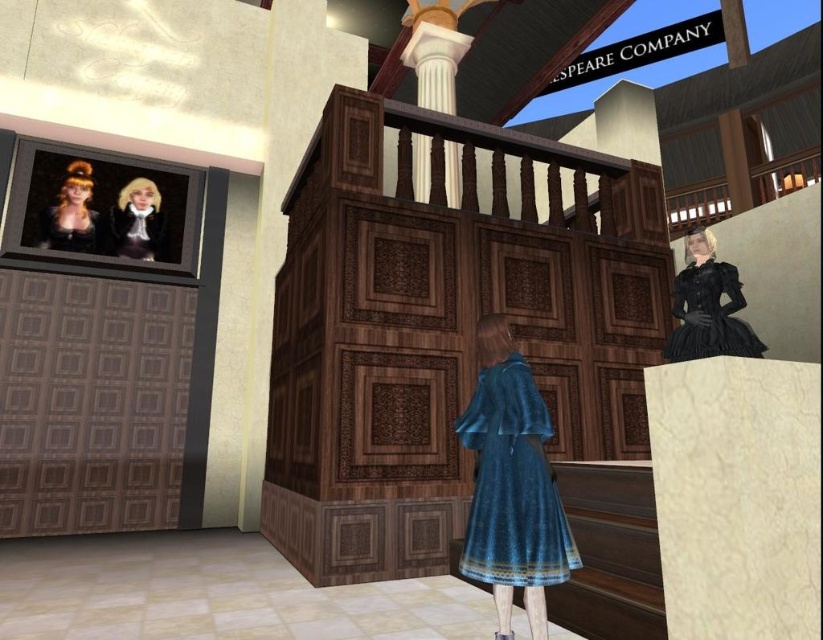
Does smooth black dress at upper left have a greater width compared to matte black dress at upper left?

Yes, smooth black dress at upper left is wider than matte black dress at upper left.

What do you see at coordinates (138, 221) in the screenshot? I see `smooth black dress at upper left` at bounding box center [138, 221].

Image resolution: width=823 pixels, height=640 pixels. What do you see at coordinates (138, 221) in the screenshot?
I see `smooth black dress at upper left` at bounding box center [138, 221].

Where is `smooth black dress at upper left`? This screenshot has width=823, height=640. smooth black dress at upper left is located at coordinates (138, 221).

Can you confirm if velvet blue dress at center is smaller than smooth black dress at upper left?

Incorrect, velvet blue dress at center is not smaller in size than smooth black dress at upper left.

Is velvet blue dress at center below smooth black dress at upper left?

Yes, velvet blue dress at center is below smooth black dress at upper left.

Which is behind, point (510, 477) or point (142, 241)?

The point (142, 241) is more distant.

Locate an element on the screen. The width and height of the screenshot is (823, 640). velvet blue dress at center is located at coordinates (512, 484).

Does black satin dress at upper right have a larger size compared to matte black hair at upper left?

Indeed, black satin dress at upper right has a larger size compared to matte black hair at upper left.

Does black satin dress at upper right appear on the left side of matte black hair at upper left?

Incorrect, black satin dress at upper right is not on the left side of matte black hair at upper left.

Find the location of a particular element. This screenshot has width=823, height=640. black satin dress at upper right is located at coordinates (707, 307).

This screenshot has height=640, width=823. What are the coordinates of `black satin dress at upper right` in the screenshot? It's located at (707, 307).